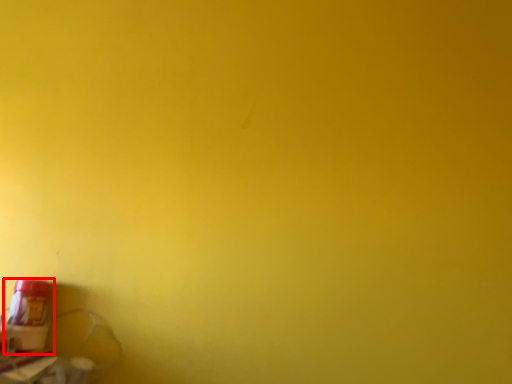
Question: From the image's perspective, what is the correct spatial relationship of bottle (annotated by the red box) in relation to window sill?

Choices:
 (A) above
 (B) below

Answer: (A)